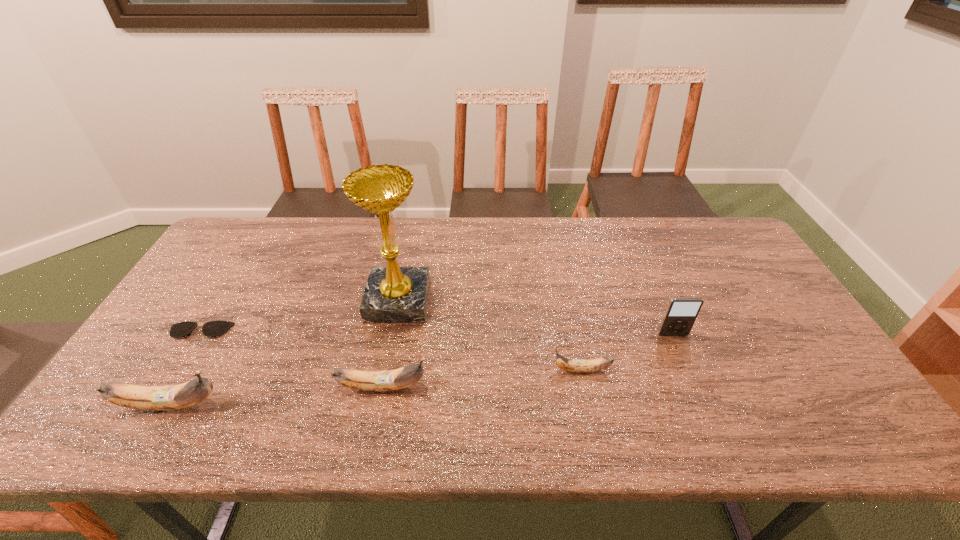
Identify the location of the leftmost banana. (168, 397).

Where is `the second shortest banana`? This screenshot has width=960, height=540. the second shortest banana is located at coordinates (387, 380).

Locate an element on the screen. the third nearest object is located at coordinates (571, 365).

The height and width of the screenshot is (540, 960). I want to click on the second shortest object, so click(571, 365).

What are the coordinates of `the shortest object` in the screenshot? It's located at (212, 328).

Locate an element on the screen. iPod is located at coordinates (681, 313).

Where is `award`? This screenshot has width=960, height=540. award is located at coordinates (393, 294).

Identify the location of free region located 0.360m on the peel of the leftmost banana. This screenshot has width=960, height=540. (381, 404).

This screenshot has width=960, height=540. In order to click on free location located 0.100m on the peel of the second shortest banana in this screenshot , I will do `click(470, 387)`.

At what (x,y) coordinates should I click in order to perform the action: click on blank area located 0.180m on the peel of the fifth tallest object. Please return your answer as a coordinate pair (x, y). This screenshot has height=540, width=960. Looking at the image, I should click on (479, 370).